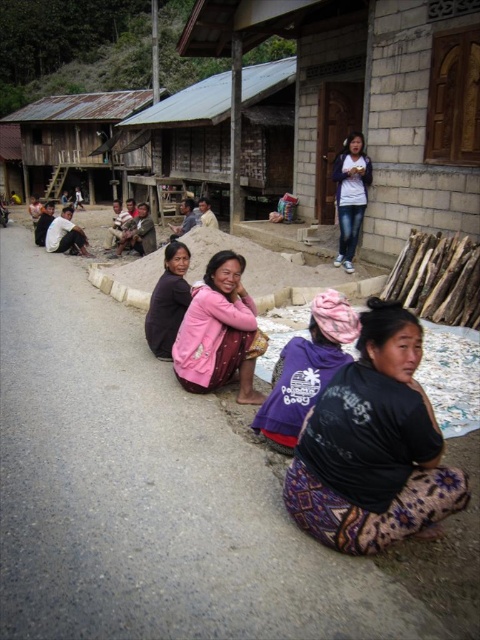
You are a tailor in the village and need to decide which material to use for a new dress. You have the jeans at upper center and the dark purple fabric at center. Which one has a larger size available?

The jeans at upper center is bigger than the dark purple fabric at center, so the jeans at upper center has a larger size available.